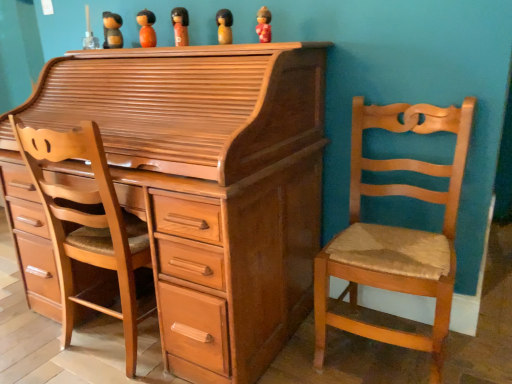
Find the location of `light brown wood swivel chair at left`. light brown wood swivel chair at left is located at coordinates (88, 224).

What is the approximate width of light brown wood chair at right?

light brown wood chair at right is 19.36 inches wide.

Where is `matte red figurine at upper center, which ranks as the fifth toy in left-to-right order`? The height and width of the screenshot is (384, 512). matte red figurine at upper center, which ranks as the fifth toy in left-to-right order is located at coordinates (264, 25).

Locate an element on the screen. This screenshot has width=512, height=384. orange matte wooden doll at upper center, the second toy when ordered from left to right is located at coordinates (146, 28).

The image size is (512, 384). In order to click on wooden figurine at upper center, the 5th toy in the right-to-left sequence in this screenshot , I will do `click(112, 30)`.

Could you measure the distance between matte orange doll at center, placed as the third toy when sorted from right to left, and light brown wood swivel chair at left?

A distance of 33.55 inches exists between matte orange doll at center, placed as the third toy when sorted from right to left, and light brown wood swivel chair at left.

Is matte orange doll at center, placed as the third toy when sorted from right to left, not close to light brown wood swivel chair at left?

No.

Considering the relative positions of matte orange doll at center, the 3th toy from the left, and light brown wood swivel chair at left in the image provided, is matte orange doll at center, the 3th toy from the left, in front of light brown wood swivel chair at left?

That is False.

Considering the relative sizes of matte orange doll at center, the 3th toy from the left, and light brown wood swivel chair at left in the image provided, is matte orange doll at center, the 3th toy from the left, taller than light brown wood swivel chair at left?

In fact, matte orange doll at center, the 3th toy from the left, may be shorter than light brown wood swivel chair at left.

Is matte red figurine at upper center, acting as the 1th toy starting from the right, bigger or smaller than orange matte wooden doll at upper center, the second toy when ordered from left to right?

In the image, matte red figurine at upper center, acting as the 1th toy starting from the right, appears to be smaller than orange matte wooden doll at upper center, the second toy when ordered from left to right.

Which object is further away from the camera, matte red figurine at upper center, acting as the 1th toy starting from the right, or orange matte wooden doll at upper center, the second toy when ordered from left to right?

orange matte wooden doll at upper center, the second toy when ordered from left to right, is more distant.

Does point (260, 12) lie behind point (148, 42)?

No.

Is wooden figurine at upper center, the 2th toy when ordered from right to left, shorter than matte orange doll at center, placed as the third toy when sorted from right to left?

Yes.

Locate an element on the screen. toy that is the 1st object to the right of the matte orange doll at center, placed as the third toy when sorted from right to left, starting at the anchor is located at coordinates (224, 26).

From a real-world perspective, which is physically above, wooden figurine at upper center, the 2th toy when ordered from right to left, or matte orange doll at center, placed as the third toy when sorted from right to left?

matte orange doll at center, placed as the third toy when sorted from right to left, from a real-world perspective.

Which of these two, light brown wood chair at right or light brown wood chest of drawers at center, is wider?

Wider between the two is light brown wood chest of drawers at center.

Which object is more forward, light brown wood chair at right or light brown wood chest of drawers at center?

light brown wood chest of drawers at center is closer to the camera.

Would you say light brown wood chest of drawers at center is part of light brown wood chair at right's contents?

No, light brown wood chest of drawers at center is located outside of light brown wood chair at right.

How different are the orientations of light brown wood chair at right and light brown wood chest of drawers at center in degrees?

The angular difference between light brown wood chair at right and light brown wood chest of drawers at center is 1.06 degrees.

Can you tell me how much matte orange doll at center, placed as the third toy when sorted from right to left, and light brown wood chest of drawers at center differ in facing direction?

There is a 0.816-degree angle between the facing directions of matte orange doll at center, placed as the third toy when sorted from right to left, and light brown wood chest of drawers at center.

Is light brown wood chest of drawers at center at the back of matte orange doll at center, the 3th toy from the left?

No, matte orange doll at center, the 3th toy from the left, is not facing the opposite direction of light brown wood chest of drawers at center.

Is matte orange doll at center, placed as the third toy when sorted from right to left, positioned far away from light brown wood chest of drawers at center?

matte orange doll at center, placed as the third toy when sorted from right to left, is near light brown wood chest of drawers at center, not far away.

Does point (184, 33) lie in front of point (143, 198)?

No, it is behind (143, 198).

Image resolution: width=512 pixels, height=384 pixels. Find the location of `toy that is the 4th one below the orange matte wooden doll at upper center, positioned as the 4th toy in right-to-left order (from a real-world perspective)`. toy that is the 4th one below the orange matte wooden doll at upper center, positioned as the 4th toy in right-to-left order (from a real-world perspective) is located at coordinates click(264, 25).

Is orange matte wooden doll at upper center, the second toy when ordered from left to right, thinner than matte red figurine at upper center, acting as the 1th toy starting from the right?

No, orange matte wooden doll at upper center, the second toy when ordered from left to right, is not thinner than matte red figurine at upper center, acting as the 1th toy starting from the right.

Could you tell me if orange matte wooden doll at upper center, the second toy when ordered from left to right, is turned towards matte red figurine at upper center, acting as the 1th toy starting from the right?

No, orange matte wooden doll at upper center, the second toy when ordered from left to right, is not aimed at matte red figurine at upper center, acting as the 1th toy starting from the right.

Considering their positions, is wooden figurine at upper center, arranged as the fourth toy when viewed from the left, located in front of or behind wooden figurine at upper center, the 5th toy in the right-to-left sequence?

Clearly, wooden figurine at upper center, arranged as the fourth toy when viewed from the left, is in front of wooden figurine at upper center, the 5th toy in the right-to-left sequence.

From the picture: Is wooden figurine at upper center, arranged as the fourth toy when viewed from the left, far away from wooden figurine at upper center, the 5th toy in the right-to-left sequence?

No, there isn't a large distance between wooden figurine at upper center, arranged as the fourth toy when viewed from the left, and wooden figurine at upper center, the 5th toy in the right-to-left sequence.

Considering the sizes of wooden figurine at upper center, arranged as the fourth toy when viewed from the left, and wooden figurine at upper center, the 5th toy in the right-to-left sequence, in the image, is wooden figurine at upper center, arranged as the fourth toy when viewed from the left, bigger or smaller than wooden figurine at upper center, the 5th toy in the right-to-left sequence,?

wooden figurine at upper center, arranged as the fourth toy when viewed from the left, is smaller than wooden figurine at upper center, the 5th toy in the right-to-left sequence.

Is wooden figurine at upper center, arranged as the fourth toy when viewed from the left, aimed at wooden figurine at upper center, the 5th toy in the right-to-left sequence?

No, wooden figurine at upper center, arranged as the fourth toy when viewed from the left, is not aimed at wooden figurine at upper center, the 5th toy in the right-to-left sequence.

Where is `swivel chair that is below the matte orange doll at center, placed as the third toy when sorted from right to left (from the image's perspective)`? swivel chair that is below the matte orange doll at center, placed as the third toy when sorted from right to left (from the image's perspective) is located at coordinates (88, 224).

The image size is (512, 384). I want to click on the 3rd toy behind the matte red figurine at upper center, acting as the 1th toy starting from the right, so click(x=146, y=28).

Considering their positions, is light brown wood swivel chair at left positioned further to orange matte wooden doll at upper center, positioned as the 4th toy in right-to-left order, than matte orange doll at center, placed as the third toy when sorted from right to left?

light brown wood swivel chair at left lies further to orange matte wooden doll at upper center, positioned as the 4th toy in right-to-left order, than the other object.

Estimate the real-world distances between objects in this image. Which object is further from light brown wood swivel chair at left, orange matte wooden doll at upper center, the second toy when ordered from left to right, or light brown wood chest of drawers at center?

orange matte wooden doll at upper center, the second toy when ordered from left to right, lies further to light brown wood swivel chair at left than the other object.

In the scene shown: Based on their spatial positions, is wooden figurine at upper center, the 2th toy when ordered from right to left, or light brown wood chair at right further from light brown wood chest of drawers at center?

Based on the image, wooden figurine at upper center, the 2th toy when ordered from right to left, appears to be further to light brown wood chest of drawers at center.

Which object lies further to the anchor point orange matte wooden doll at upper center, positioned as the 4th toy in right-to-left order, matte red figurine at upper center, which ranks as the fifth toy in left-to-right order, or matte orange doll at center, the 3th toy from the left?

Based on the image, matte red figurine at upper center, which ranks as the fifth toy in left-to-right order, appears to be further to orange matte wooden doll at upper center, positioned as the 4th toy in right-to-left order.

Looking at this image, considering their positions, is light brown wood chest of drawers at center positioned closer to orange matte wooden doll at upper center, positioned as the 4th toy in right-to-left order, than wooden figurine at upper center, the 5th toy in the right-to-left sequence?

The object closer to orange matte wooden doll at upper center, positioned as the 4th toy in right-to-left order, is wooden figurine at upper center, the 5th toy in the right-to-left sequence.

Estimate the real-world distances between objects in this image. Which object is further from matte red figurine at upper center, acting as the 1th toy starting from the right, wooden figurine at upper center, which is the 1th toy in left-to-right order, or matte orange doll at center, the 3th toy from the left?

wooden figurine at upper center, which is the 1th toy in left-to-right order, is positioned further to the anchor matte red figurine at upper center, acting as the 1th toy starting from the right.

Estimate the real-world distances between objects in this image. Which object is closer to light brown wood swivel chair at left, light brown wood chair at right or matte red figurine at upper center, which ranks as the fifth toy in left-to-right order?

Based on the image, light brown wood chair at right appears to be nearer to light brown wood swivel chair at left.

Considering their positions, is light brown wood swivel chair at left positioned further to matte red figurine at upper center, acting as the 1th toy starting from the right, than wooden figurine at upper center, arranged as the fourth toy when viewed from the left?

light brown wood swivel chair at left is positioned further to the anchor matte red figurine at upper center, acting as the 1th toy starting from the right.

Locate an element on the screen. The image size is (512, 384). chest of drawers between wooden figurine at upper center, the 5th toy in the right-to-left sequence, and light brown wood swivel chair at left, in the vertical direction is located at coordinates (210, 183).

Find the location of `chest of drawers between wooden figurine at upper center, the 5th toy in the right-to-left sequence, and light brown wood chair at right`. chest of drawers between wooden figurine at upper center, the 5th toy in the right-to-left sequence, and light brown wood chair at right is located at coordinates (210, 183).

This screenshot has height=384, width=512. In order to click on toy situated between wooden figurine at upper center, which is the 1th toy in left-to-right order, and matte orange doll at center, placed as the third toy when sorted from right to left, from left to right in this screenshot , I will do `click(146, 28)`.

The height and width of the screenshot is (384, 512). I want to click on chest of drawers between matte red figurine at upper center, which ranks as the fifth toy in left-to-right order, and light brown wood swivel chair at left in the up-down direction, so click(x=210, y=183).